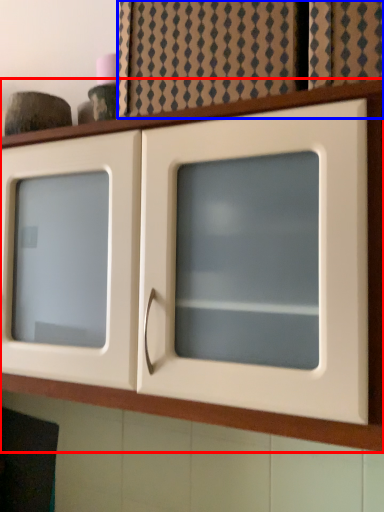
Question: Which of the following is the closest to the observer, cupboard (highlighted by a red box) or curtain (highlighted by a blue box)?

Choices:
 (A) cupboard
 (B) curtain

Answer: (A)